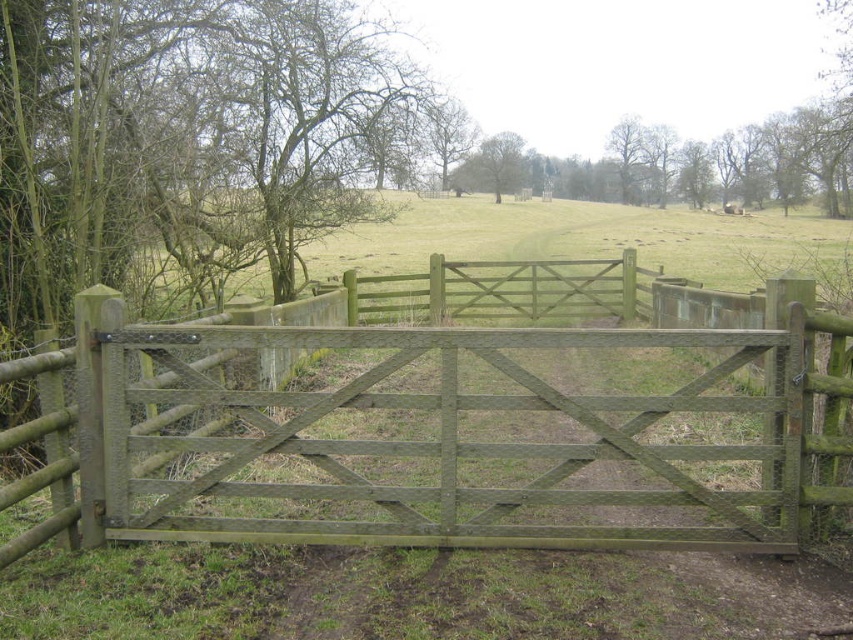
You are standing in front of the green wood gate at center. If you want to walk through it, which direction should you move relative to your current position?

Since the green wood gate at center is located at point (434, 410), you should move forward towards the gate to walk through it.